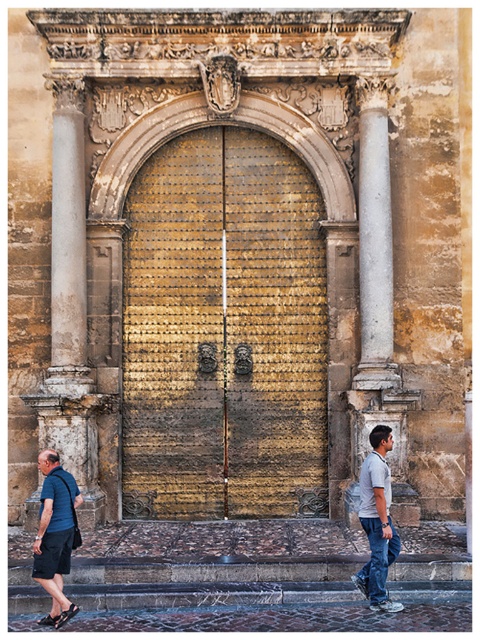
In the scene shown: Can you confirm if gold textured door at center is positioned above stone steps at lower center?

Indeed, gold textured door at center is positioned over stone steps at lower center.

Is gold textured door at center taller than stone steps at lower center?

Indeed, gold textured door at center has a greater height compared to stone steps at lower center.

The image size is (480, 640). What are the coordinates of `gold textured door at center` in the screenshot? It's located at (224, 332).

Find the location of `matte blue shirt at lower left`. matte blue shirt at lower left is located at coordinates (55, 536).

Can you confirm if matte blue shirt at lower left is positioned above gray cotton shirt at lower right?

No.

Is point (46, 554) behind point (380, 541)?

No, (46, 554) is in front of (380, 541).

Identify the location of matte blue shirt at lower left. The height and width of the screenshot is (640, 480). (55, 536).

Does gray cotton shirt at lower right have a lesser height compared to denim jeans at lower right?

In fact, gray cotton shirt at lower right may be taller than denim jeans at lower right.

Can you confirm if gray cotton shirt at lower right is positioned below denim jeans at lower right?

No, gray cotton shirt at lower right is not below denim jeans at lower right.

The width and height of the screenshot is (480, 640). I want to click on gray cotton shirt at lower right, so click(x=376, y=522).